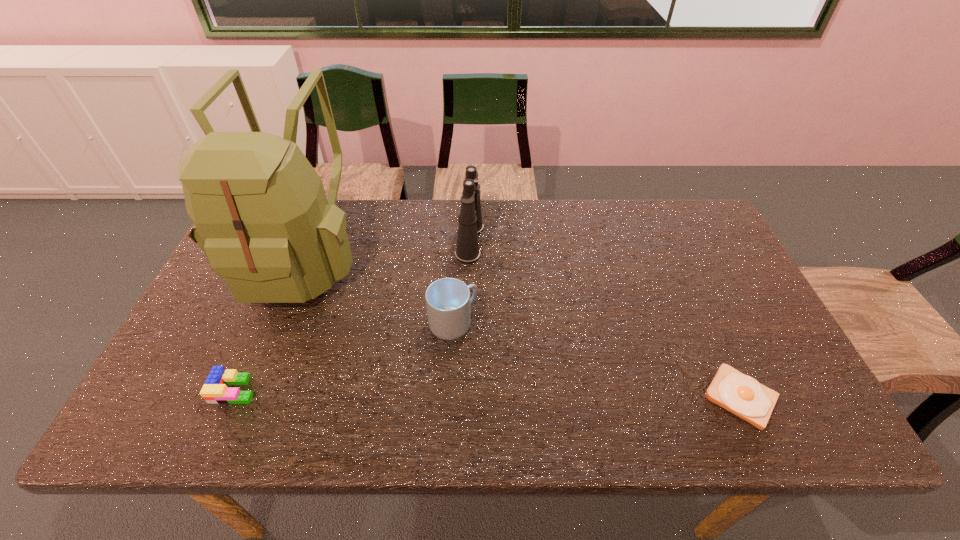
What are the coordinates of `the tallest object` in the screenshot? It's located at (261, 216).

The image size is (960, 540). Identify the location of the fourth shortest object. (467, 251).

Locate an element on the screen. the third shortest object is located at coordinates (448, 301).

Locate an element on the screen. The height and width of the screenshot is (540, 960). the fourth tallest object is located at coordinates [214, 390].

I want to click on toast, so click(x=740, y=394).

The height and width of the screenshot is (540, 960). I want to click on the rightmost object, so click(x=740, y=394).

The width and height of the screenshot is (960, 540). Find the location of `vacant space located 0.140m on the front pocket of the tallest object`. vacant space located 0.140m on the front pocket of the tallest object is located at coordinates (258, 364).

Where is `vacant space situated 0.170m on the right of the binoculars`? vacant space situated 0.170m on the right of the binoculars is located at coordinates (539, 241).

Identify the location of vacant space situated 0.200m on the back of the mug. This screenshot has width=960, height=540. (457, 255).

Find the location of `free spot located 0.150m on the right of the Lego`. free spot located 0.150m on the right of the Lego is located at coordinates (321, 389).